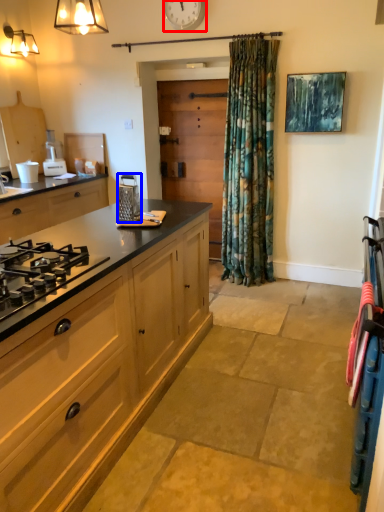
Question: Which object is further to the camera taking this photo, clock (highlighted by a red box) or kitchen appliance (highlighted by a blue box)?

Choices:
 (A) clock
 (B) kitchen appliance

Answer: (A)